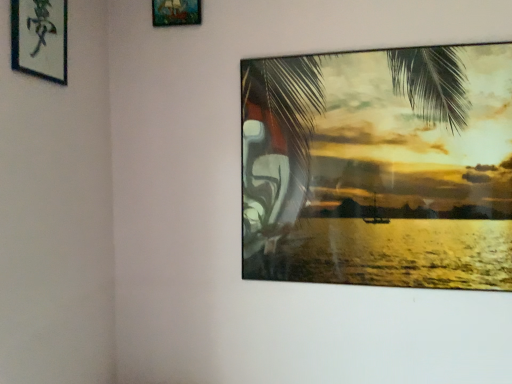
Question: From a real-world perspective, is wooden frame at upper center, the first picture frame when ordered from right to left, physically above silky green palm tree at upper right?

Choices:
 (A) no
 (B) yes

Answer: (B)

Question: Is wooden frame at upper center, the 2th picture frame positioned from the bottom, wider than silky green palm tree at upper right?

Choices:
 (A) no
 (B) yes

Answer: (A)

Question: Is wooden frame at upper center, the 2th picture frame positioned from the bottom, taller than silky green palm tree at upper right?

Choices:
 (A) yes
 (B) no

Answer: (B)

Question: Is wooden frame at upper center, the first picture frame when ordered from right to left, directly adjacent to silky green palm tree at upper right?

Choices:
 (A) yes
 (B) no

Answer: (B)

Question: Could you tell me if wooden frame at upper center, placed as the first picture frame when sorted from back to front, is facing silky green palm tree at upper right?

Choices:
 (A) no
 (B) yes

Answer: (A)

Question: Considering the relative sizes of wooden frame at upper center, placed as the first picture frame when sorted from back to front, and silky green palm tree at upper right in the image provided, is wooden frame at upper center, placed as the first picture frame when sorted from back to front, bigger than silky green palm tree at upper right?

Choices:
 (A) no
 (B) yes

Answer: (A)

Question: Is wooden frame at upper center, the 2th picture frame when ordered from left to right, smaller than black paper at upper left, arranged as the second picture frame when viewed from the top?

Choices:
 (A) yes
 (B) no

Answer: (A)

Question: Considering the relative positions of wooden frame at upper center, the 2th picture frame when ordered from left to right, and black paper at upper left, arranged as the second picture frame when viewed from the top, in the image provided, is wooden frame at upper center, the 2th picture frame when ordered from left to right, to the left of black paper at upper left, arranged as the second picture frame when viewed from the top, from the viewer's perspective?

Choices:
 (A) no
 (B) yes

Answer: (A)

Question: Is black paper at upper left, positioned as the first picture frame in front-to-back order, at the back of wooden frame at upper center, the first picture frame when ordered from right to left?

Choices:
 (A) yes
 (B) no

Answer: (B)

Question: Does wooden frame at upper center, the 2th picture frame when ordered from left to right, touch black paper at upper left, positioned as the first picture frame in front-to-back order?

Choices:
 (A) yes
 (B) no

Answer: (B)

Question: Is wooden frame at upper center, which ranks as the second picture frame in front-to-back order, positioned before black paper at upper left, arranged as the second picture frame when viewed from the top?

Choices:
 (A) no
 (B) yes

Answer: (A)

Question: Is wooden frame at upper center, placed as the first picture frame when sorted from back to front, not near black paper at upper left, arranged as the second picture frame when viewed from the top?

Choices:
 (A) yes
 (B) no

Answer: (B)

Question: Considering the relative sizes of silky green palm tree at upper right and wooden frame at upper center, placed as the first picture frame when sorted from back to front, in the image provided, is silky green palm tree at upper right taller than wooden frame at upper center, placed as the first picture frame when sorted from back to front,?

Choices:
 (A) no
 (B) yes

Answer: (B)